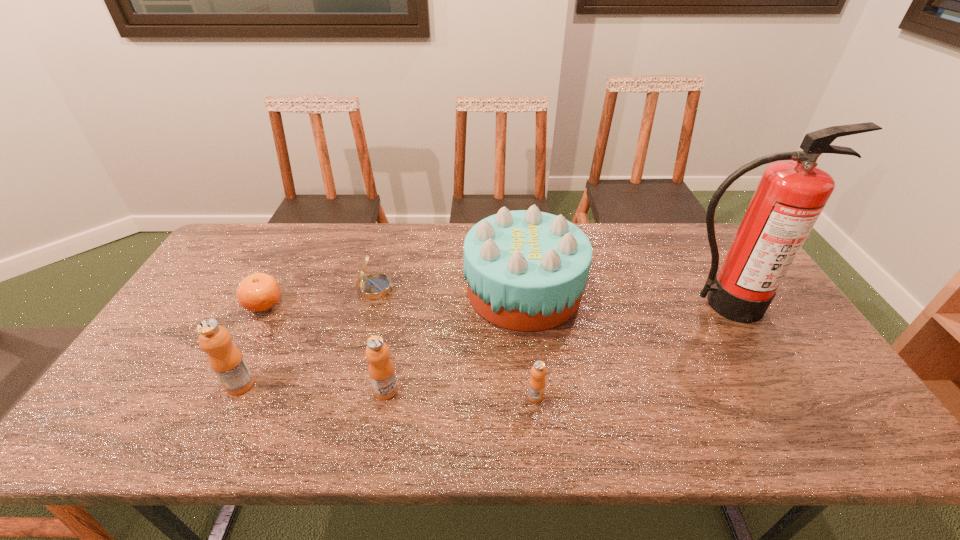
At what (x,y) coordinates should I click in order to perform the action: click on the leftmost orange juice. Please return your answer as a coordinate pair (x, y). The image size is (960, 540). Looking at the image, I should click on (226, 360).

Where is `the second shortest orange juice`? The image size is (960, 540). the second shortest orange juice is located at coordinates (381, 369).

Where is `the fourth shortest object`? This screenshot has height=540, width=960. the fourth shortest object is located at coordinates (381, 369).

This screenshot has height=540, width=960. Find the location of `the rightmost orange juice`. the rightmost orange juice is located at coordinates (537, 381).

In order to click on the shortest object in this screenshot , I will do `click(258, 292)`.

Image resolution: width=960 pixels, height=540 pixels. I want to click on cake, so click(526, 270).

Where is `compass`? This screenshot has height=540, width=960. compass is located at coordinates (374, 286).

In order to click on the tallest object in this screenshot , I will do `click(790, 196)`.

Locate an element on the screen. The image size is (960, 540). the rightmost object is located at coordinates (790, 196).

Where is `vacant space located 0.250m on the front label of the leftmost orange juice`? The height and width of the screenshot is (540, 960). vacant space located 0.250m on the front label of the leftmost orange juice is located at coordinates (125, 384).